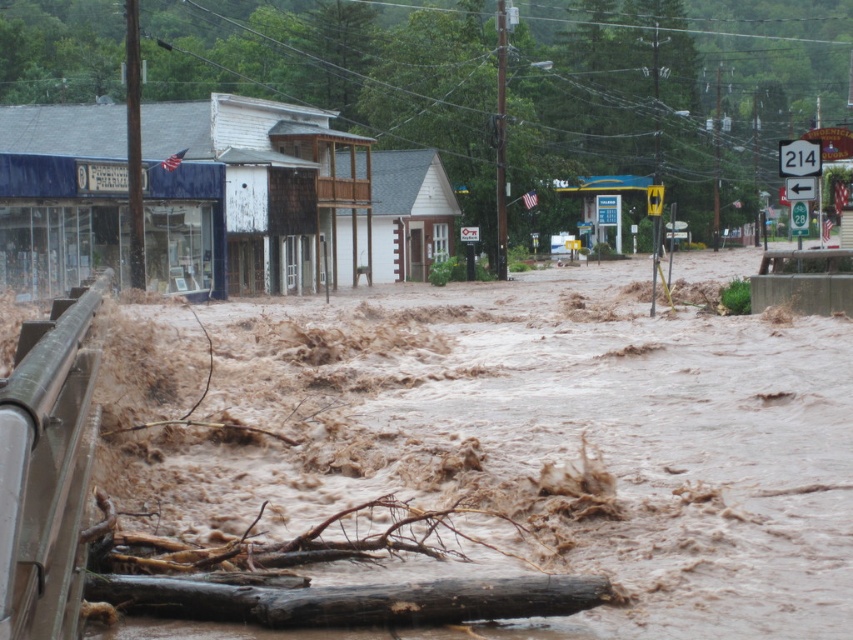
You are a rescue worker trying to reach the white wooden building at center. You are currently standing on the brown rough wood log at lower center. Which direction should you move to reach the building?

The white wooden building at center is further to the viewer than the brown rough wood log at lower center, so you should move forward towards it.

You are a rescue worker trying to navigate through the flooded area. You see the brown muddy water at lower left and the white wooden building at center. Which one has a larger area in the image?

The white wooden building at center has a larger area than the brown muddy water at lower left.

You are a rescue worker trying to navigate through the flooded area. There is a brown rough wood log at lower center and brown muddy water at lower left. Which object is closer to your right side when facing the direction of the log?

The brown muddy water at lower left is positioned on the right side of brown rough wood log at lower center, so when facing the direction of the log, the brown muddy water at lower left would be on your right side.